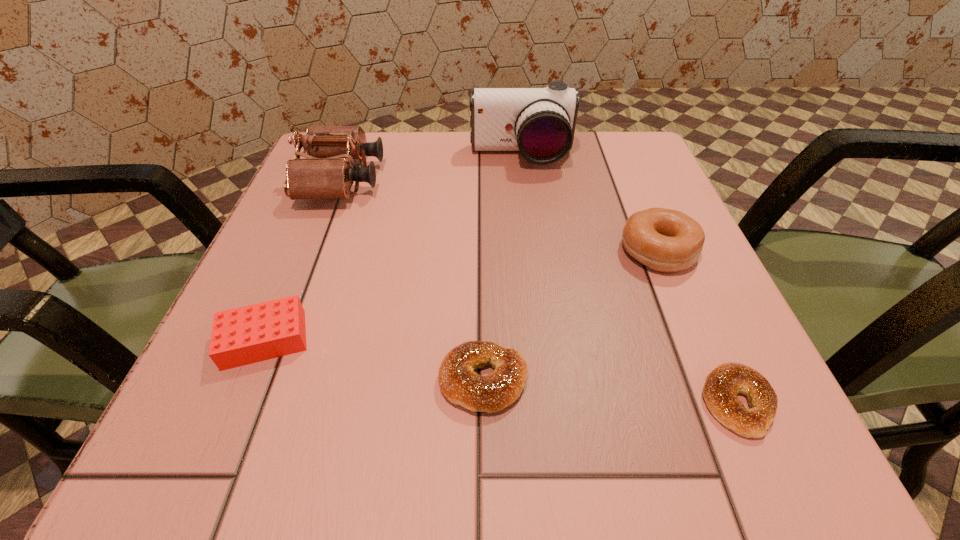
Identify the location of the tallest object. (539, 122).

Find the location of a particular element. Image resolution: width=960 pixels, height=540 pixels. binoculars is located at coordinates (327, 173).

You are a GUI agent. You are given a task and a screenshot of the screen. Output one action in this format:
    pyautogui.click(x=<x>, y=<y>)
    Task: Click on the fourth nearest object
    Image resolution: width=960 pixels, height=540 pixels.
    Given the screenshot: What is the action you would take?
    pyautogui.click(x=664, y=240)

What are the coordinates of `the farthest bagel` in the screenshot? It's located at (664, 240).

You are a GUI agent. You are given a task and a screenshot of the screen. Output one action in this format:
    pyautogui.click(x=<x>, y=<y>)
    Task: Click on the fourth tallest object
    The width and height of the screenshot is (960, 540).
    Given the screenshot: What is the action you would take?
    pyautogui.click(x=249, y=334)

Where is `the leftmost bagel`? This screenshot has height=540, width=960. the leftmost bagel is located at coordinates (458, 382).

I want to click on the second shortest object, so click(x=458, y=382).

Find the location of a particular element. the shortest object is located at coordinates (722, 384).

The width and height of the screenshot is (960, 540). In order to click on vacant space located 0.130m on the surface of the tallest object in this screenshot , I will do coord(527,209).

The height and width of the screenshot is (540, 960). I want to click on vacant area located through the eyepieces of the binoculars, so click(430, 180).